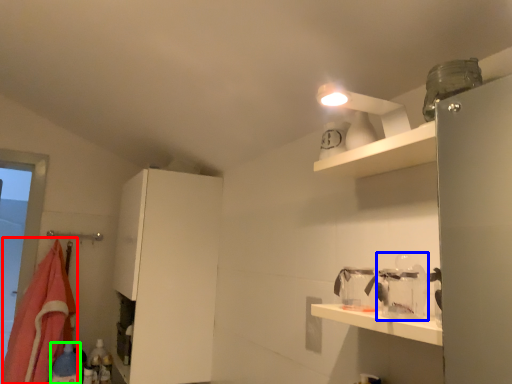
Question: Considering the real-world distances, which object is closest to blanket (highlighted by a red box)? glass jar (highlighted by a blue box) or bottle (highlighted by a green box).

Choices:
 (A) glass jar
 (B) bottle

Answer: (B)